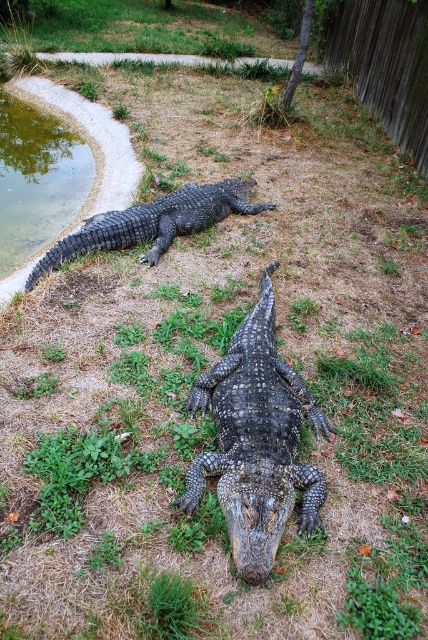
Looking at this image, is greenish water at bottom left smaller than dark scaly crocodile at center?

Yes, greenish water at bottom left is smaller than dark scaly crocodile at center.

This screenshot has width=428, height=640. I want to click on greenish water at bottom left, so click(x=36, y=179).

What do you see at coordinates (36, 179) in the screenshot? I see `greenish water at bottom left` at bounding box center [36, 179].

Locate an element on the screen. The image size is (428, 640). greenish water at bottom left is located at coordinates tap(36, 179).

Can you confirm if shiny black crocodile at center is smaller than greenish water at bottom left?

No.

Does shiny black crocodile at center appear on the left side of greenish water at bottom left?

No, shiny black crocodile at center is not to the left of greenish water at bottom left.

Who is more forward, (x=265, y=486) or (x=23, y=221)?

Point (x=265, y=486)

Image resolution: width=428 pixels, height=640 pixels. I want to click on shiny black crocodile at center, so click(x=255, y=442).

Between point (252, 566) and point (241, 193), which one is positioned behind?

Positioned behind is point (241, 193).

Who is higher up, shiny black crocodile at center or dark scaly crocodile at center?

dark scaly crocodile at center is above.

The image size is (428, 640). What do you see at coordinates (255, 442) in the screenshot?
I see `shiny black crocodile at center` at bounding box center [255, 442].

Locate an element on the screen. shiny black crocodile at center is located at coordinates (255, 442).